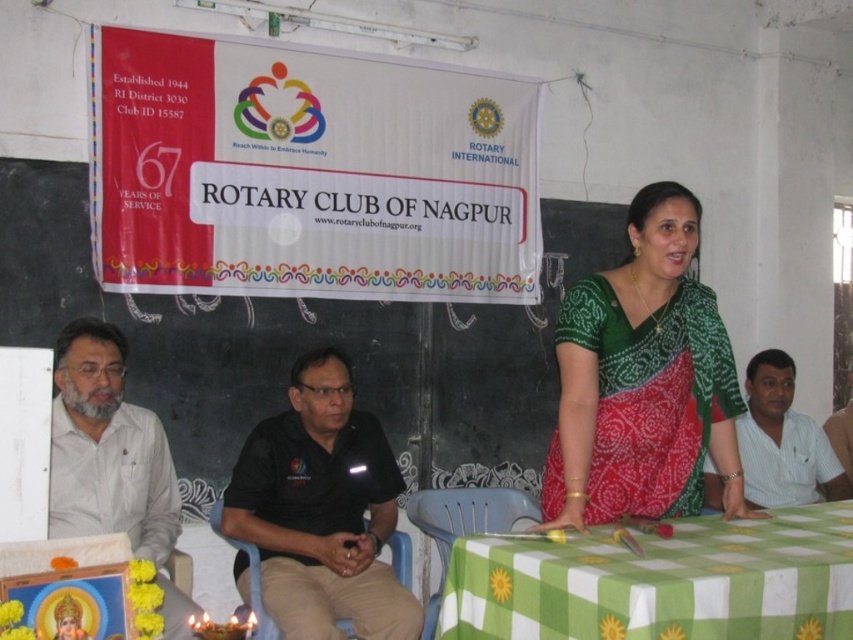
Question: Does green printed saree at center have a larger size compared to beige cotton shirt at left?

Choices:
 (A) no
 (B) yes

Answer: (A)

Question: Is green checkered tablecloth at center positioned in front of white cotton shirt at center?

Choices:
 (A) yes
 (B) no

Answer: (A)

Question: Which of the following is the farthest from the observer?

Choices:
 (A) (650, 476)
 (B) (833, 440)
 (C) (264, 458)

Answer: (B)

Question: Which of the following is the farthest from the observer?

Choices:
 (A) green printed saree at center
 (B) beige cotton shirt at left
 (C) white cotton shirt at center

Answer: (C)

Question: Which point is closer to the camera?

Choices:
 (A) green printed saree at center
 (B) black smooth shirt at center
 (C) beige cotton shirt at left
 (D) green checkered tablecloth at center

Answer: (D)

Question: Does green printed saree at center have a larger size compared to white fabric shirt at right?

Choices:
 (A) no
 (B) yes

Answer: (B)